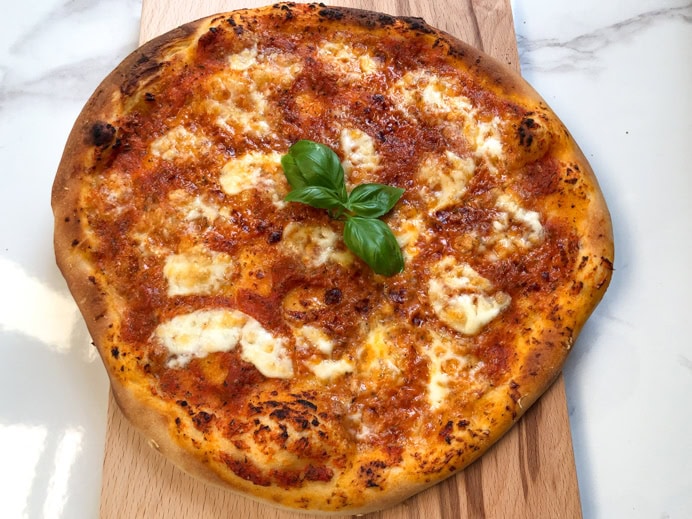
At what (x,y) coordinates should I click in order to perform the action: click on wood cutting board. Please return your answer as a coordinate pair (x, y). Looking at the image, I should click on (504, 490).